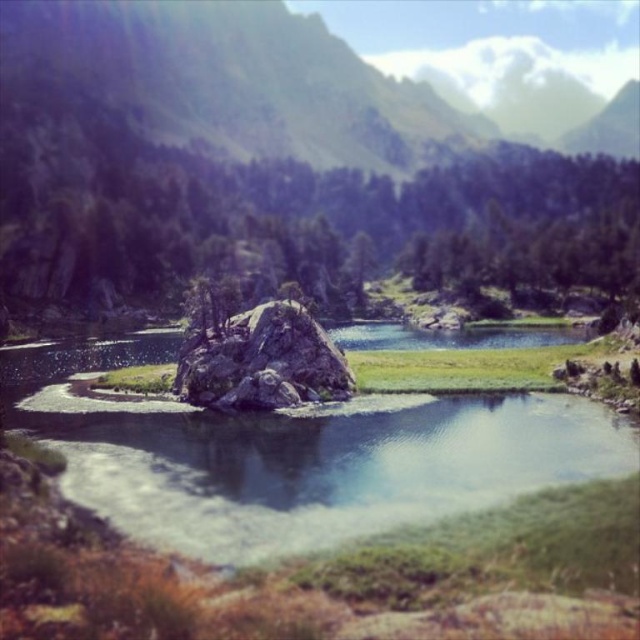
Question: Which point is closer to the camera?

Choices:
 (A) smooth rock at center
 (B) green textured rock at center

Answer: (A)

Question: Does green textured rock at center have a greater width compared to smooth rock at center?

Choices:
 (A) yes
 (B) no

Answer: (A)

Question: Does green textured rock at center have a greater width compared to smooth rock at center?

Choices:
 (A) no
 (B) yes

Answer: (B)

Question: Is green textured rock at center further to the viewer compared to smooth rock at center?

Choices:
 (A) yes
 (B) no

Answer: (A)